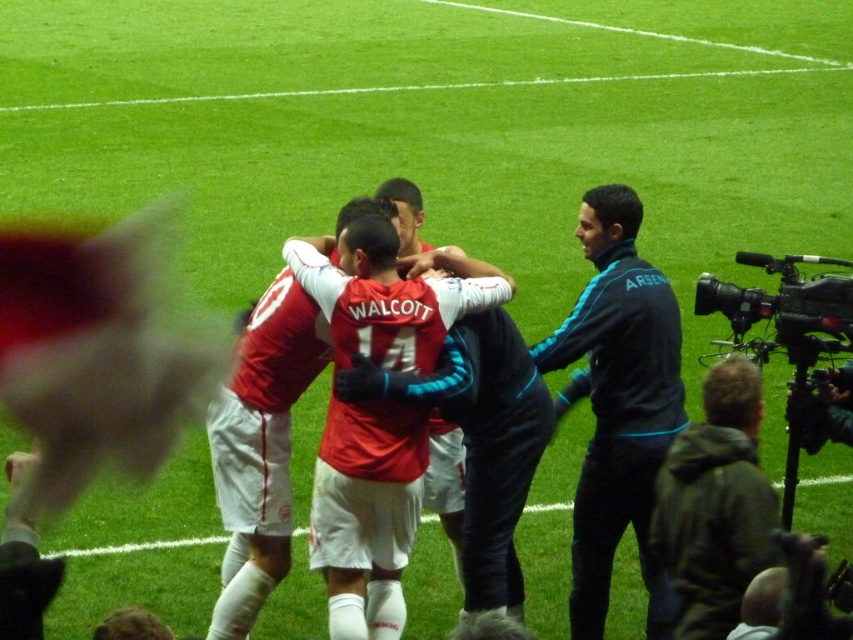
Question: Among these points, which one is nearest to the camera?

Choices:
 (A) (703, 589)
 (B) (289, 547)

Answer: (A)

Question: Which point appears farthest from the camera in this image?

Choices:
 (A) [x=579, y=330]
 (B) [x=686, y=516]

Answer: (A)

Question: From the image, what is the correct spatial relationship of blue synthetic jacket at right in relation to matte red jersey at center?

Choices:
 (A) below
 (B) above

Answer: (B)

Question: Is blue synthetic jacket at right smaller than black plastic video camera at right?

Choices:
 (A) yes
 (B) no

Answer: (B)

Question: Is matte red jersey at center wider than black plastic video camera at right?

Choices:
 (A) no
 (B) yes

Answer: (A)

Question: Which is farther from the dark gray hoodie at lower right?

Choices:
 (A) blue synthetic jacket at right
 (B) black plastic video camera at right

Answer: (B)